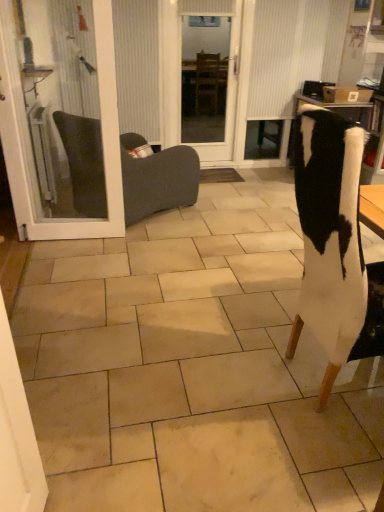
Question: In the image, is white fur chair at right, placed as the second chair when sorted from left to right, positioned in front of or behind dark gray fabric chair at left, which is the second chair in front-to-back order?

Choices:
 (A) behind
 (B) front

Answer: (B)

Question: In terms of width, does white fur chair at right, placed as the second chair when sorted from left to right, look wider or thinner when compared to dark gray fabric chair at left, which ranks as the 2th chair in right-to-left order?

Choices:
 (A) wide
 (B) thin

Answer: (B)

Question: Which object is positioned closest to the white glass door at left?

Choices:
 (A) transparent glass door at center
 (B) dark gray fabric chair at left, which is the 1th chair in back-to-front order
 (C) white textured curtain at upper center
 (D) white fur chair at right, placed as the first chair when sorted from right to left

Answer: (B)

Question: Considering the real-world distances, which object is farthest from the dark gray fabric chair at left, acting as the 1th chair starting from the left?

Choices:
 (A) white fur chair at right, placed as the second chair when sorted from left to right
 (B) white glass door at left
 (C) white textured curtain at upper center
 (D) transparent glass door at center

Answer: (A)